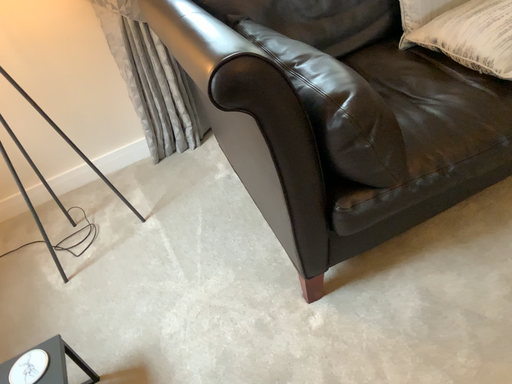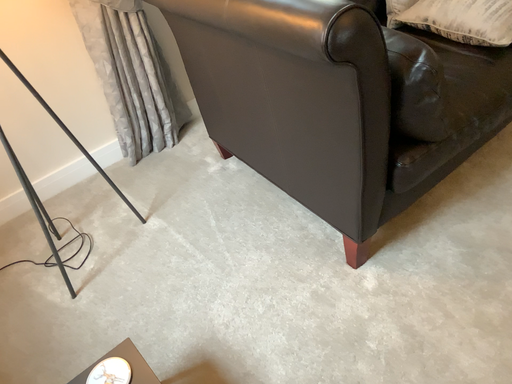
Question: How did the camera likely rotate when shooting the video?

Choices:
 (A) rotated left
 (B) rotated right

Answer: (B)